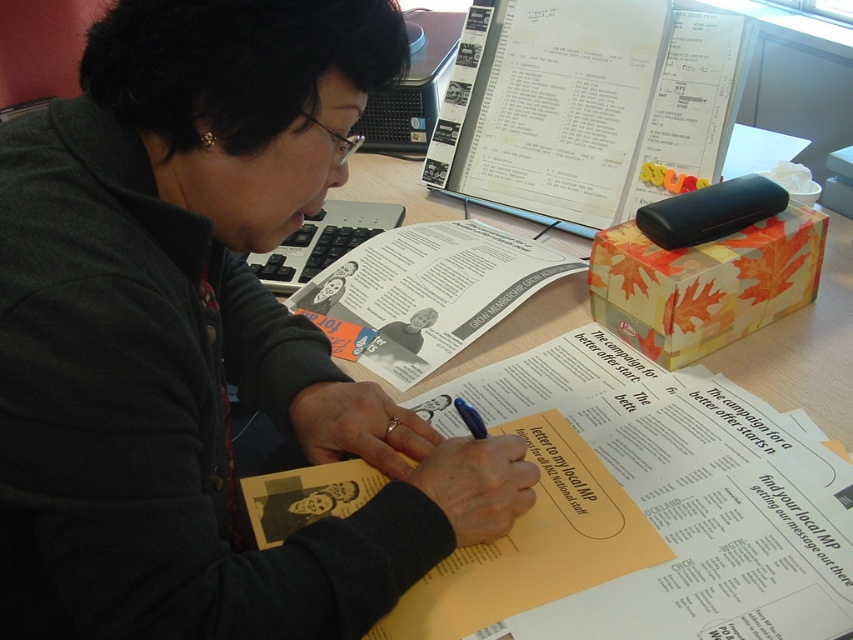
Between matte black sweater at center and black plastic computer at upper center, which one is positioned lower?

matte black sweater at center is lower down.

Which is in front, point (45, 326) or point (363, 150)?

Point (45, 326) is more forward.

You are a GUI agent. You are given a task and a screenshot of the screen. Output one action in this format:
    pyautogui.click(x=<x>, y=<y>)
    Task: Click on the matte black sweater at center
    The height and width of the screenshot is (640, 853).
    Given the screenshot: What is the action you would take?
    pyautogui.click(x=201, y=339)

The height and width of the screenshot is (640, 853). Identify the location of wooden table at center. (480, 317).

Is point (567, 364) positioned before point (471, 408)?

No.

What are the coordinates of `wooden table at center` in the screenshot? It's located at (480, 317).

The height and width of the screenshot is (640, 853). Find the location of `wooden table at center`. wooden table at center is located at coordinates (480, 317).

Between wooden table at center and black plastic computer at upper center, which one is positioned higher?

Positioned higher is black plastic computer at upper center.

Find the location of `wooden table at center`. wooden table at center is located at coordinates (480, 317).

Measure the distance between wooden table at center and camera.

The distance of wooden table at center from camera is 20.59 inches.

Image resolution: width=853 pixels, height=640 pixels. I want to click on wooden table at center, so click(480, 317).